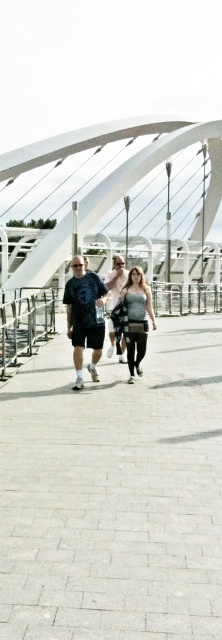
From the picture: You are planning to cross the white glossy pedestrian bridge at center while carrying a large backpack. There is a person wearing a light pink cotton shirt at center walking towards you. Do you think there is enough space for both of you to pass safely without bumping into each other?

The white glossy pedestrian bridge at center might be wider than light pink cotton shirt at center, so there is likely enough space for both of you to pass safely without bumping into each other.